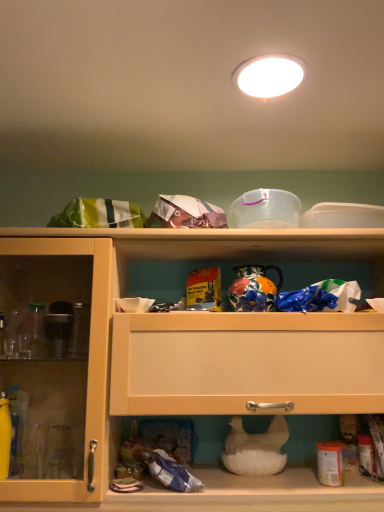
Find the location of a particular element. Image resolution: width=384 pixels, height=512 pixels. free spot above white glossy light fixture at upper center (from a real-world perspective) is located at coordinates (258, 76).